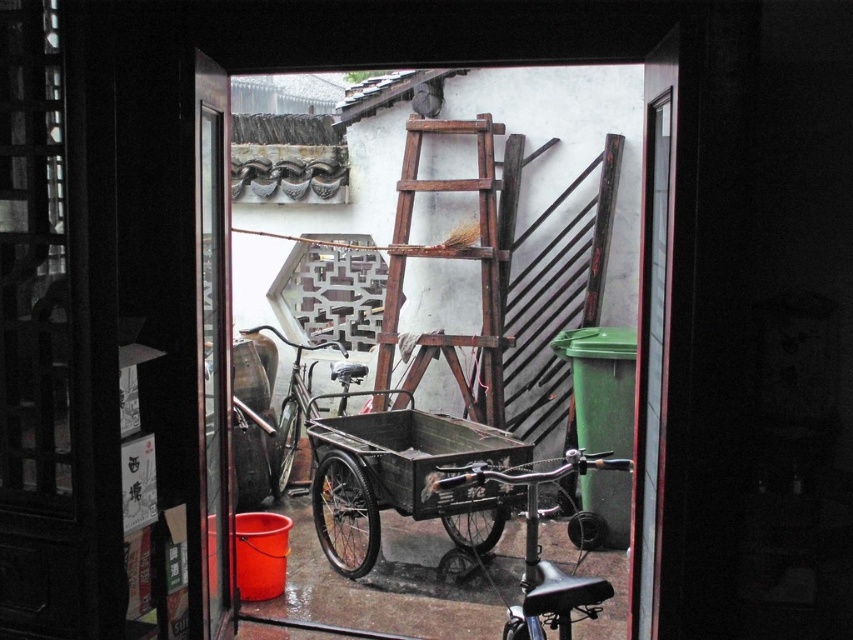
Question: Which object is farther from the camera taking this photo?

Choices:
 (A) black matte cart at center
 (B) shiny black bicycle at center
 (C) wooden rustic ladder at center
 (D) shiny metallic bicycle at center

Answer: (D)

Question: Among these objects, which one is nearest to the camera?

Choices:
 (A) wooden rustic ladder at center
 (B) black matte cart at center
 (C) shiny black bicycle at center

Answer: (C)

Question: Is black matte cart at center to the right of wooden rustic ladder at center from the viewer's perspective?

Choices:
 (A) yes
 (B) no

Answer: (B)

Question: Observing the image, what is the correct spatial positioning of wooden rustic ladder at center in reference to shiny metallic bicycle at center?

Choices:
 (A) right
 (B) left

Answer: (A)

Question: In this image, where is wooden rustic ladder at center located relative to shiny metallic bicycle at center?

Choices:
 (A) below
 (B) above

Answer: (B)

Question: Which point appears closest to the camera in this image?

Choices:
 (A) (280, 496)
 (B) (479, 253)
 (C) (318, 522)
 (D) (590, 467)

Answer: (D)